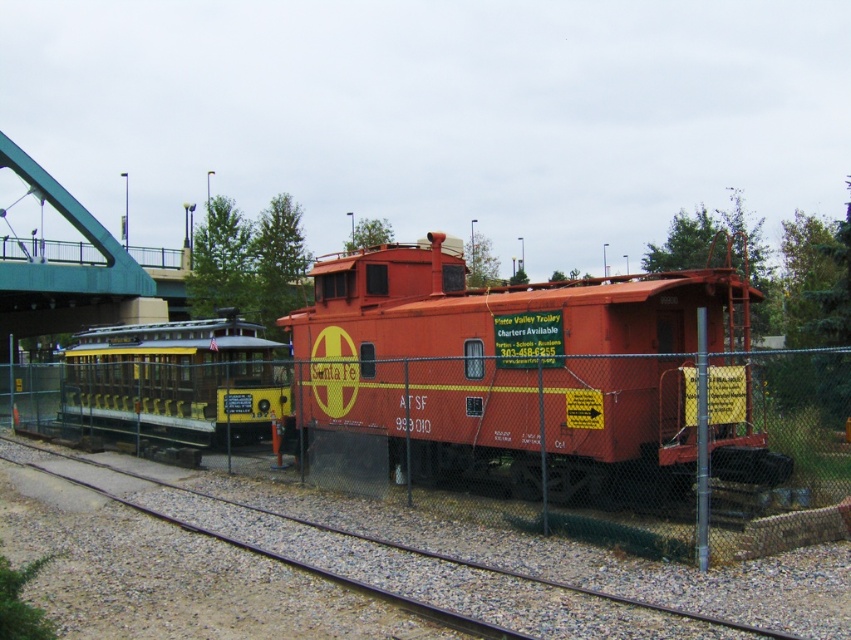
Locate an element on the screen. The width and height of the screenshot is (851, 640). metal chain-link fence at center is located at coordinates (783, 449).

Consider the image. Can you confirm if metal chain-link fence at center is bigger than metal train track at lower center?

Correct, metal chain-link fence at center is larger in size than metal train track at lower center.

Is point (631, 472) closer to camera compared to point (67, 480)?

Yes.

The width and height of the screenshot is (851, 640). In order to click on metal chain-link fence at center in this screenshot , I will do `click(783, 449)`.

Which of these two, matte red caboose at center or metal chain-link fence at center, stands shorter?

With less height is metal chain-link fence at center.

How far apart are matte red caboose at center and metal chain-link fence at center?

matte red caboose at center is 1.24 meters away from metal chain-link fence at center.

Image resolution: width=851 pixels, height=640 pixels. Describe the element at coordinates (512, 371) in the screenshot. I see `matte red caboose at center` at that location.

Locate an element on the screen. The image size is (851, 640). matte red caboose at center is located at coordinates (512, 371).

Is yellow polished metal trolley at center positioned behind metal train track at lower center?

Yes, yellow polished metal trolley at center is further from the viewer.

Can you confirm if yellow polished metal trolley at center is shorter than metal train track at lower center?

Incorrect, yellow polished metal trolley at center's height does not fall short of metal train track at lower center's.

This screenshot has width=851, height=640. What do you see at coordinates (176, 380) in the screenshot?
I see `yellow polished metal trolley at center` at bounding box center [176, 380].

You are a GUI agent. You are given a task and a screenshot of the screen. Output one action in this format:
    pyautogui.click(x=<x>, y=<y>)
    Task: Click on the yellow polished metal trolley at center
    
    Given the screenshot: What is the action you would take?
    pyautogui.click(x=176, y=380)